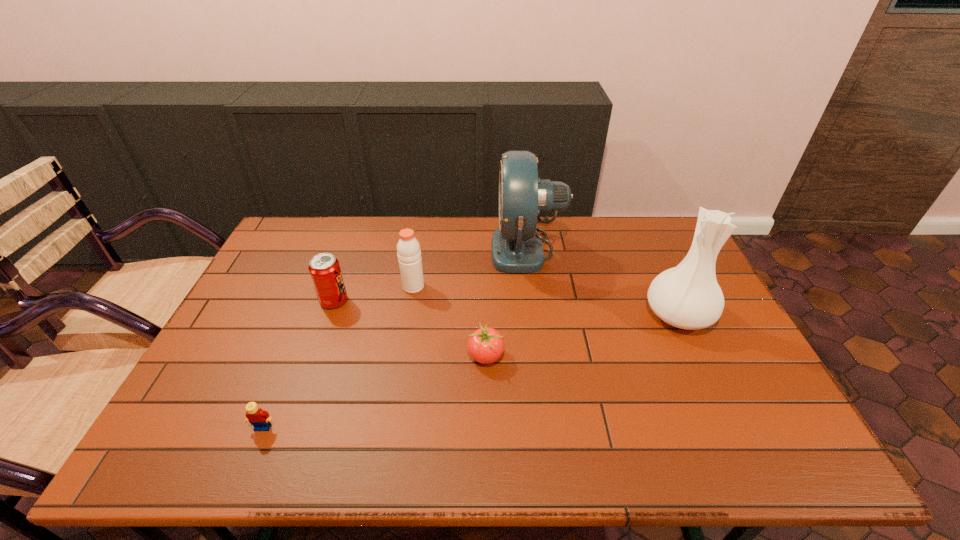
Find the location of a particular element. This screenshot has width=960, height=540. free region located on the front of the vase is located at coordinates (732, 428).

Where is `vacant area located 0.250m on the right of the third tallest object`? The image size is (960, 540). vacant area located 0.250m on the right of the third tallest object is located at coordinates (505, 286).

This screenshot has width=960, height=540. Identify the location of vacant region located on the back of the soda can. (347, 267).

Where is `vacant space located 0.130m on the front of the tomato`? This screenshot has width=960, height=540. vacant space located 0.130m on the front of the tomato is located at coordinates (487, 417).

The width and height of the screenshot is (960, 540). I want to click on object present at the far edge, so click(x=516, y=247).

Image resolution: width=960 pixels, height=540 pixels. I want to click on object at the near edge, so click(259, 418).

This screenshot has width=960, height=540. In order to click on object that is at the right edge in this screenshot , I will do `click(687, 296)`.

Identify the location of vacant space at the far edge. The height and width of the screenshot is (540, 960). (480, 224).

The width and height of the screenshot is (960, 540). Find the location of `free region at the near edge of the desktop`. free region at the near edge of the desktop is located at coordinates (605, 457).

Where is `free space at the left edge of the desktop`? The height and width of the screenshot is (540, 960). free space at the left edge of the desktop is located at coordinates (228, 414).